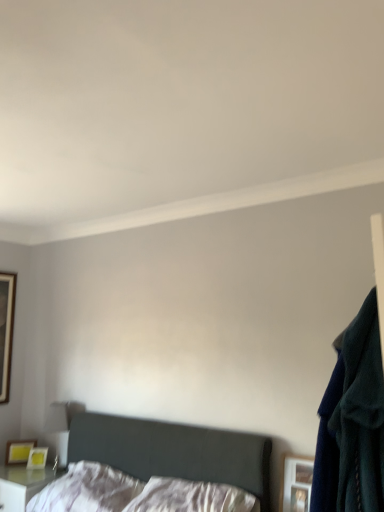
Question: Is white satin pillow at center, which is counted as the 2th pillow, starting from the left, positioned before matte yellow picture frame at lower left, which appears as the second picture frame when viewed from the front?

Choices:
 (A) no
 (B) yes

Answer: (B)

Question: Does white satin pillow at center, arranged as the 1th pillow when viewed from the right, turn towards matte yellow picture frame at lower left, arranged as the 2th picture frame when viewed from the left?

Choices:
 (A) yes
 (B) no

Answer: (B)

Question: Is white satin pillow at center, arranged as the 1th pillow when viewed from the right, placed right next to matte yellow picture frame at lower left, marked as the 1th picture frame in a bottom-to-top arrangement?

Choices:
 (A) yes
 (B) no

Answer: (B)

Question: Considering the relative sizes of white satin pillow at center, arranged as the 1th pillow when viewed from the right, and matte yellow picture frame at lower left, marked as the 1th picture frame in a bottom-to-top arrangement, in the image provided, is white satin pillow at center, arranged as the 1th pillow when viewed from the right, shorter than matte yellow picture frame at lower left, marked as the 1th picture frame in a bottom-to-top arrangement,?

Choices:
 (A) no
 (B) yes

Answer: (A)

Question: Does white satin pillow at center, which is counted as the 2th pillow, starting from the left, have a smaller size compared to matte yellow picture frame at lower left, marked as the 3th picture frame in a top-to-bottom arrangement?

Choices:
 (A) no
 (B) yes

Answer: (A)

Question: Considering the positions of white satin pillow at center, which is counted as the 2th pillow, starting from the left, and navy blue sweater at right in the image, is white satin pillow at center, which is counted as the 2th pillow, starting from the left, bigger or smaller than navy blue sweater at right?

Choices:
 (A) big
 (B) small

Answer: (A)

Question: From a real-world perspective, is white satin pillow at center, arranged as the 1th pillow when viewed from the right, positioned above or below navy blue sweater at right?

Choices:
 (A) above
 (B) below

Answer: (B)

Question: From the image's perspective, is white satin pillow at center, which is counted as the 2th pillow, starting from the left, positioned above or below navy blue sweater at right?

Choices:
 (A) above
 (B) below

Answer: (B)

Question: Would you say white satin pillow at center, arranged as the 1th pillow when viewed from the right, is inside or outside navy blue sweater at right?

Choices:
 (A) outside
 (B) inside

Answer: (A)

Question: From a real-world perspective, is white glossy nightstand at lower left physically located above or below white soft pillow at lower center, the 1th pillow in the left-to-right sequence?

Choices:
 (A) below
 (B) above

Answer: (A)

Question: Based on their positions, is white glossy nightstand at lower left located to the left or right of white soft pillow at lower center, arranged as the second pillow when viewed from the right?

Choices:
 (A) right
 (B) left

Answer: (B)

Question: Would you say white glossy nightstand at lower left is inside or outside white soft pillow at lower center, the 1th pillow in the left-to-right sequence?

Choices:
 (A) inside
 (B) outside

Answer: (B)

Question: Is white glossy nightstand at lower left bigger or smaller than white soft pillow at lower center, the 1th pillow in the left-to-right sequence?

Choices:
 (A) big
 (B) small

Answer: (A)

Question: Is point (140, 507) positioned closer to the camera than point (3, 391)?

Choices:
 (A) closer
 (B) farther

Answer: (A)

Question: Considering the positions of white satin pillow at center, arranged as the 1th pillow when viewed from the right, and wooden framed mirror at left, the third picture frame when ordered from front to back, in the image, is white satin pillow at center, arranged as the 1th pillow when viewed from the right, taller or shorter than wooden framed mirror at left, the third picture frame when ordered from front to back,?

Choices:
 (A) tall
 (B) short

Answer: (B)